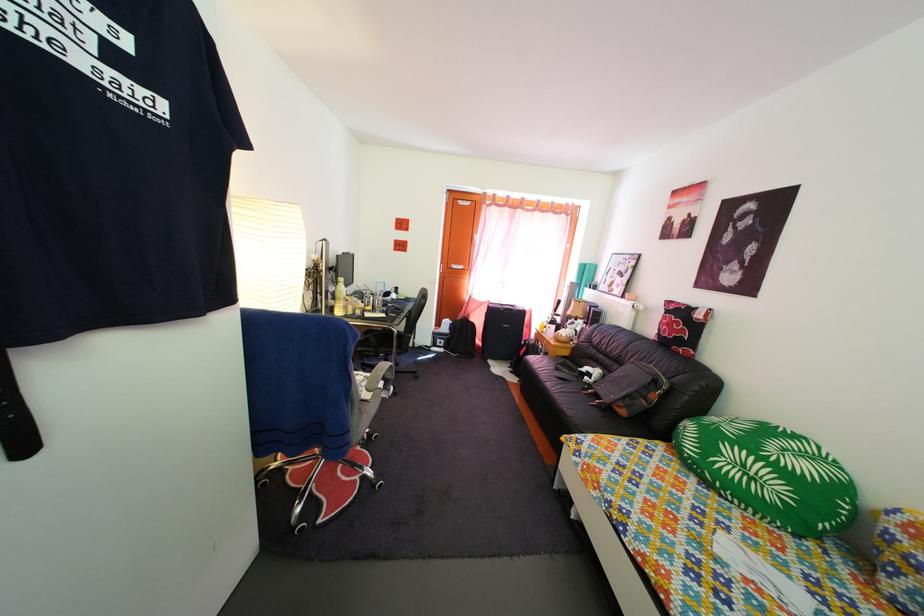
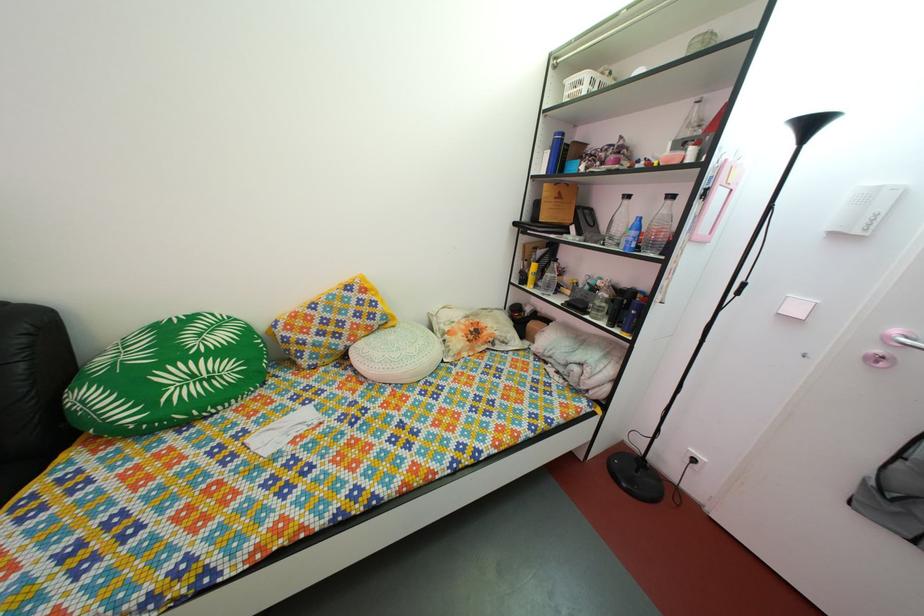
Locate, in the second image, the point that corresponds to pixel 762 487 in the first image.

(220, 387)